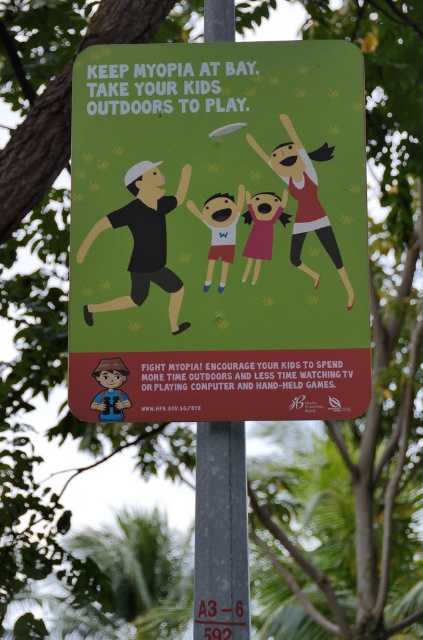
Between point (195, 483) and point (118, 412), which one is positioned behind?

Positioned behind is point (195, 483).

Is gray metallic pole at center closer to the viewer compared to brown textured hat at lower left?

No, it is behind brown textured hat at lower left.

Between point (213, 552) and point (104, 378), which one is positioned behind?

Positioned behind is point (213, 552).

Where is `gray metallic pole at center`? Image resolution: width=423 pixels, height=640 pixels. gray metallic pole at center is located at coordinates (220, 532).

Can you confirm if gray metallic pole at center is thinner than pink paper child at center?

No.

Is point (227, 566) positioned after point (246, 269)?

Yes, point (227, 566) is farther from viewer.

The image size is (423, 640). Describe the element at coordinates (220, 532) in the screenshot. I see `gray metallic pole at center` at that location.

Locate an element on the screen. The height and width of the screenshot is (640, 423). gray metallic pole at center is located at coordinates (220, 532).

Can you confirm if black matte figure at center is thinner than pink paper child at center?

No.

Is point (151, 202) closer to camera compared to point (266, 243)?

No.

This screenshot has height=640, width=423. In order to click on black matte figure at center in this screenshot , I will do `click(143, 241)`.

The width and height of the screenshot is (423, 640). I want to click on black matte figure at center, so click(x=143, y=241).